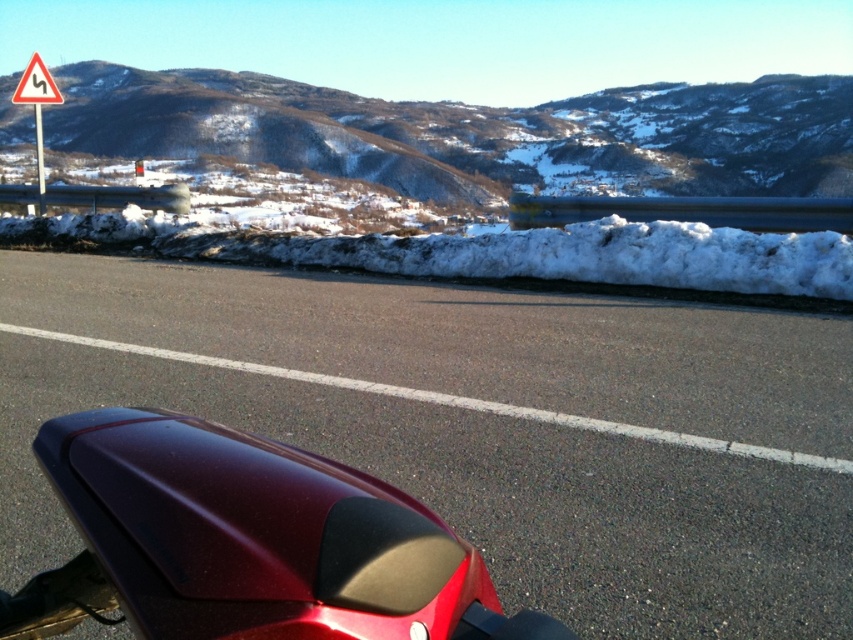
Measure the distance from glossy red motorcycle at lower center to white plastic triangle at upper left.

glossy red motorcycle at lower center is 15.13 meters from white plastic triangle at upper left.

Can you confirm if glossy red motorcycle at lower center is shorter than white plastic triangle at upper left?

Yes.

Where is `glossy red motorcycle at lower center`? This screenshot has width=853, height=640. glossy red motorcycle at lower center is located at coordinates (489, 496).

Identify the location of glossy red motorcycle at lower center. The height and width of the screenshot is (640, 853). (489, 496).

Is point (364, 179) farther from viewer compared to point (27, 83)?

Yes, it is behind point (27, 83).

The height and width of the screenshot is (640, 853). Describe the element at coordinates (474, 132) in the screenshot. I see `snowy rocky mountain at upper center` at that location.

Is point (750, 150) in front of point (49, 99)?

That is False.

Find the location of a particular element. Image resolution: width=853 pixels, height=640 pixels. snowy rocky mountain at upper center is located at coordinates (474, 132).

Describe the element at coordinates (247, 541) in the screenshot. I see `glossy maroon motorcycle at center` at that location.

Who is more distant from viewer, (x=192, y=621) or (x=38, y=172)?

The point (x=38, y=172) is behind.

Measure the distance between point (115, 545) and camera.

Point (115, 545) and camera are 37.41 inches apart.

At what (x,y) coordinates should I click in order to perform the action: click on glossy maroon motorcycle at center. Please return your answer as a coordinate pair (x, y). The height and width of the screenshot is (640, 853). Looking at the image, I should click on (247, 541).